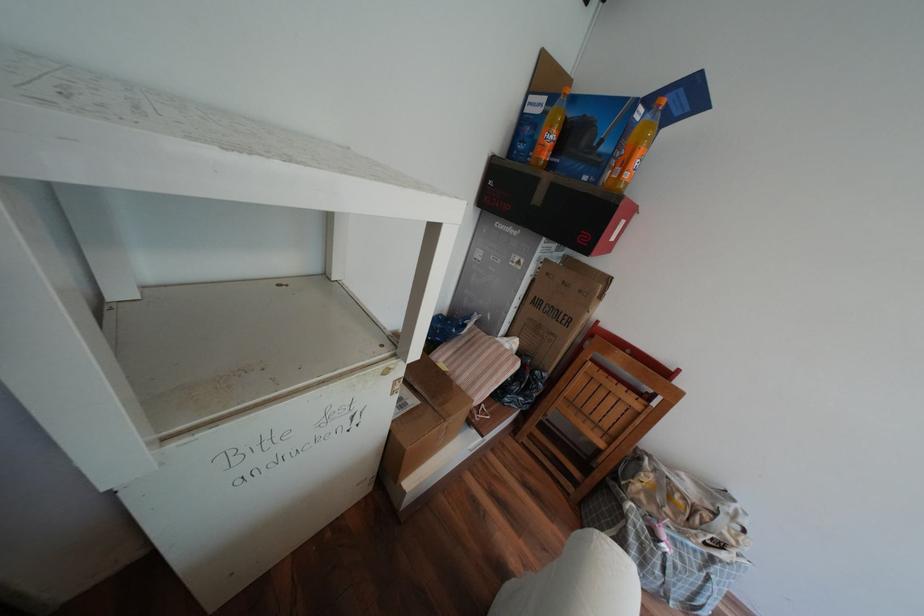
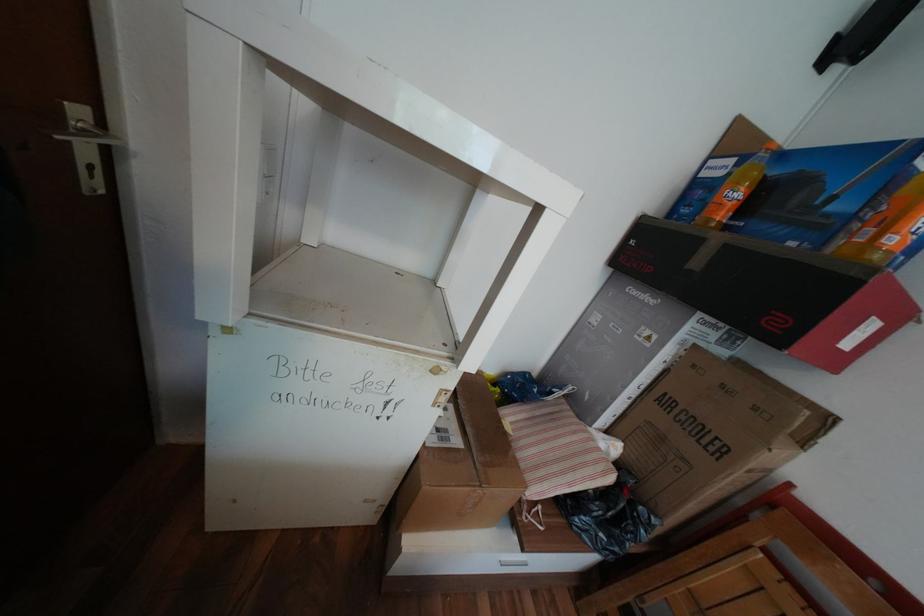
The point at (x=563, y=137) is marked in the first image. Where is the corresponding point in the second image?

(748, 195)